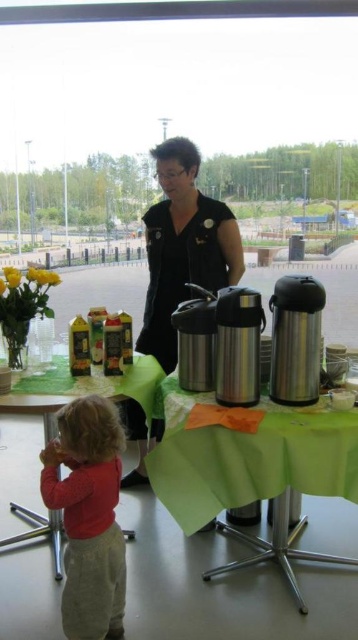
Question: Which object appears farthest from the camera in this image?

Choices:
 (A) green fabric table at lower left
 (B) green fabric table at center
 (C) matte red shirt at lower left
 (D) black fabric at center

Answer: (D)

Question: Which of the following is the closest to the observer?

Choices:
 (A) black fabric at center
 (B) matte red shirt at lower left

Answer: (B)

Question: Can you confirm if black fabric at center is positioned to the right of green fabric table at lower left?

Choices:
 (A) yes
 (B) no

Answer: (A)

Question: Which is nearer to the matte red shirt at lower left?

Choices:
 (A) black fabric at center
 (B) green fabric table at center
 (C) green fabric table at lower left

Answer: (B)

Question: Is green fabric table at center smaller than black fabric at center?

Choices:
 (A) yes
 (B) no

Answer: (A)

Question: Is green fabric table at center closer to the viewer compared to green fabric table at lower left?

Choices:
 (A) no
 (B) yes

Answer: (B)